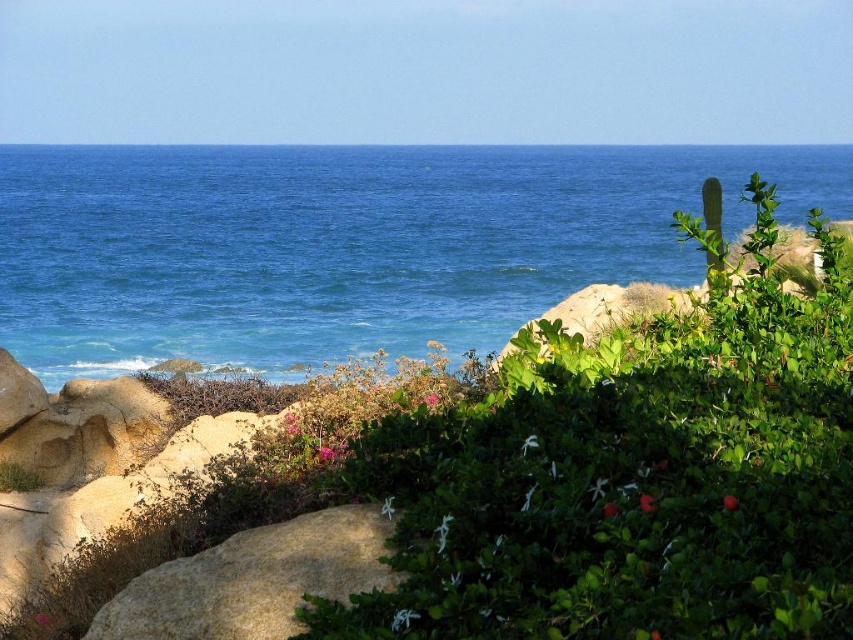
You are standing at the edge of the coastal landscape and want to place a small flag at each of the two points, point (215, 260) and point (335, 598). Which point is closer to you where you can place the flag without needing to walk further into the scene?

Point (215, 260) is closer to you than point (335, 598), so you can place the flag there without needing to walk further into the scene.